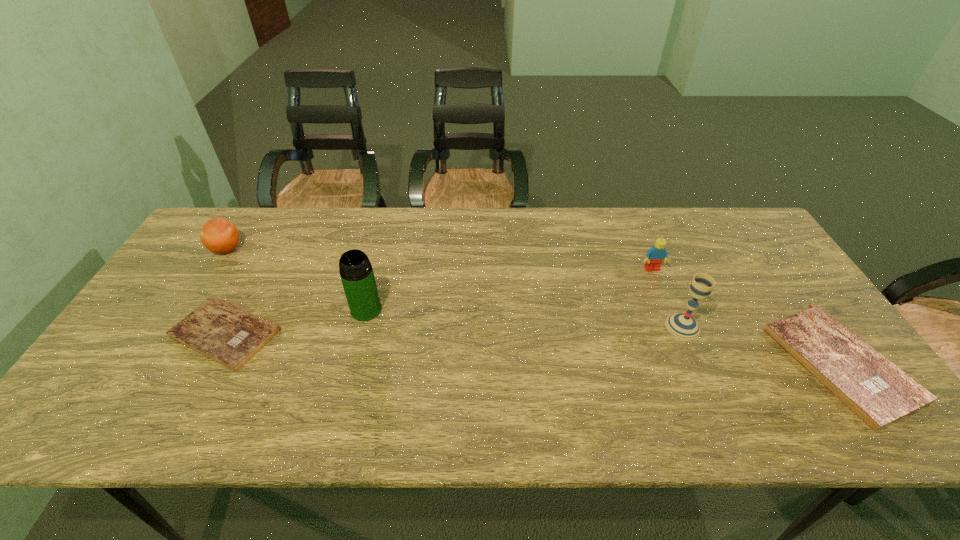
At what (x,y) coordinates should I click in order to perform the action: click on vacant space located on the back of the fifth tallest object. Please return your answer as a coordinate pair (x, y). This screenshot has height=540, width=960. Looking at the image, I should click on (776, 271).

Where is `vacant space located on the face of the Lego`? vacant space located on the face of the Lego is located at coordinates (700, 385).

Identify the location of vacant area situated 0.120m on the back of the chalice. This screenshot has width=960, height=540. (664, 282).

Locate an element on the screen. The width and height of the screenshot is (960, 540). vacant space located on the front of the orange is located at coordinates (181, 321).

The width and height of the screenshot is (960, 540). What are the coordinates of `blank space located 0.130m from the spout of the tallest object` in the screenshot? It's located at (353, 363).

Locate an element on the screen. The height and width of the screenshot is (540, 960). object positioned at the far edge is located at coordinates (219, 235).

I want to click on Bible that is at the left edge, so click(x=227, y=334).

Where is `orange positioned at the left edge`? The image size is (960, 540). orange positioned at the left edge is located at coordinates (219, 235).

Image resolution: width=960 pixels, height=540 pixels. Identify the location of object that is at the right edge. (878, 392).

Locate an element on the screen. This screenshot has width=960, height=540. object at the far left corner is located at coordinates (219, 235).